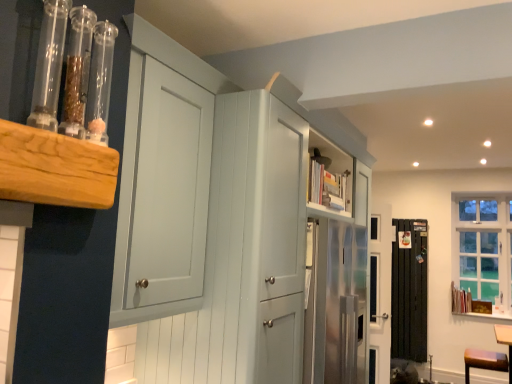
Question: Considering the relative sizes of matte white cabinet at upper center and black metal radiator at lower right in the image provided, is matte white cabinet at upper center smaller than black metal radiator at lower right?

Choices:
 (A) yes
 (B) no

Answer: (B)

Question: Can you confirm if matte white cabinet at upper center is wider than black metal radiator at lower right?

Choices:
 (A) yes
 (B) no

Answer: (A)

Question: Can you confirm if matte white cabinet at upper center is bigger than black metal radiator at lower right?

Choices:
 (A) no
 (B) yes

Answer: (B)

Question: Is matte white cabinet at upper center not near black metal radiator at lower right?

Choices:
 (A) yes
 (B) no

Answer: (A)

Question: From the image's perspective, is matte white cabinet at upper center above black metal radiator at lower right?

Choices:
 (A) yes
 (B) no

Answer: (A)

Question: From the image's perspective, relative to black metal radiator at lower right, is clear glass window at upper right above or below?

Choices:
 (A) above
 (B) below

Answer: (A)

Question: In the image, is clear glass window at upper right on the left side or the right side of black metal radiator at lower right?

Choices:
 (A) left
 (B) right

Answer: (B)

Question: Looking at the image, does clear glass window at upper right seem bigger or smaller compared to black metal radiator at lower right?

Choices:
 (A) big
 (B) small

Answer: (A)

Question: Looking at their shapes, would you say clear glass window at upper right is wider or thinner than black metal radiator at lower right?

Choices:
 (A) wide
 (B) thin

Answer: (A)

Question: Looking at their shapes, would you say clear glass window at upper right is wider or thinner than transparent glass tubes at upper left?

Choices:
 (A) wide
 (B) thin

Answer: (A)

Question: In the image, is clear glass window at upper right on the left side or the right side of transparent glass tubes at upper left?

Choices:
 (A) right
 (B) left

Answer: (A)

Question: Based on their sizes in the image, would you say clear glass window at upper right is bigger or smaller than transparent glass tubes at upper left?

Choices:
 (A) small
 (B) big

Answer: (B)

Question: Is clear glass window at upper right taller or shorter than transparent glass tubes at upper left?

Choices:
 (A) short
 (B) tall

Answer: (B)

Question: Considering the positions of clear glass window at upper right and brown wood vanity at lower right in the image, is clear glass window at upper right wider or thinner than brown wood vanity at lower right?

Choices:
 (A) wide
 (B) thin

Answer: (B)

Question: From the image's perspective, relative to brown wood vanity at lower right, is clear glass window at upper right above or below?

Choices:
 (A) below
 (B) above

Answer: (B)